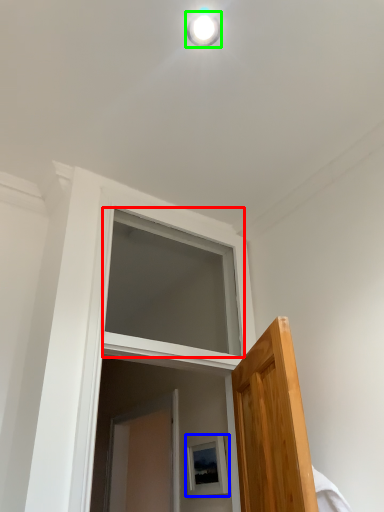
Question: Based on their relative distances, which object is nearer to window (highlighted by a red box)? Choose from picture frame (highlighted by a blue box) and light fixture (highlighted by a green box).

Choices:
 (A) picture frame
 (B) light fixture

Answer: (A)